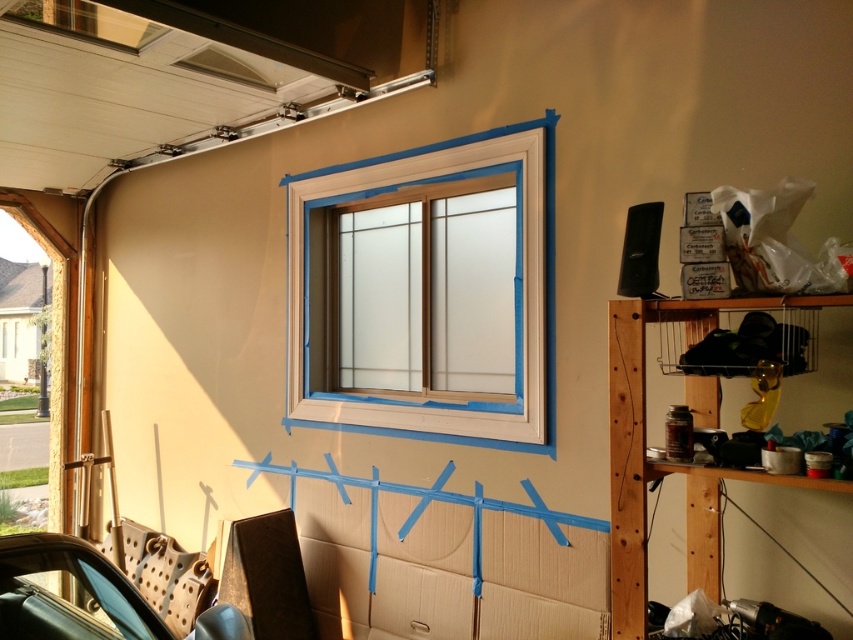
Question: Among these points, which one is nearest to the camera?

Choices:
 (A) (335, 422)
 (B) (154, 632)

Answer: (B)

Question: Is the position of beige wood window frame at center more distant than that of teal leather car seat at lower left?

Choices:
 (A) yes
 (B) no

Answer: (A)

Question: Does beige wood window frame at center have a lesser width compared to teal leather car seat at lower left?

Choices:
 (A) no
 (B) yes

Answer: (A)

Question: Among these points, which one is farthest from the camera?

Choices:
 (A) (498, 129)
 (B) (77, 624)

Answer: (A)

Question: Can you confirm if beige wood window frame at center is smaller than teal leather car seat at lower left?

Choices:
 (A) no
 (B) yes

Answer: (A)